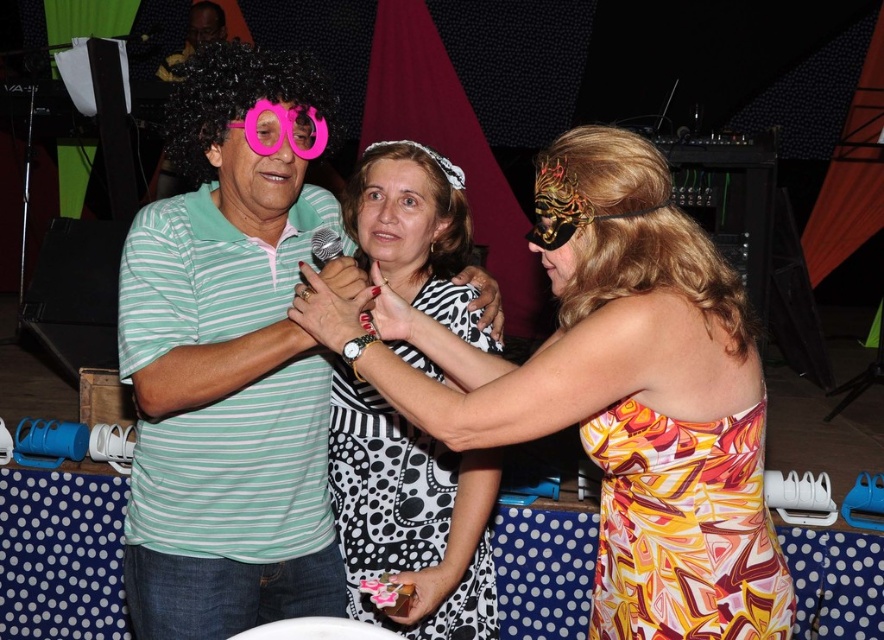
Question: Which is nearer to the black dotted fabric dress at center?

Choices:
 (A) green striped shirt at center
 (B) black curly wig at center

Answer: (A)

Question: Which of the following is the closest to the observer?

Choices:
 (A) printed fabric dress at center
 (B) black curly wig at center

Answer: (A)

Question: Is white fabric wig at center smaller than matte black wig at upper left?

Choices:
 (A) yes
 (B) no

Answer: (A)

Question: Is black curly wig at center in front of matte black wig at upper left?

Choices:
 (A) yes
 (B) no

Answer: (A)

Question: Estimate the real-world distances between objects in this image. Which object is closer to the gold metallic mask at upper right?

Choices:
 (A) black and white polka dot dress at center
 (B) green striped shirt at center
 (C) pink plastic goggles at center

Answer: (A)

Question: Is black curly wig at center wider than matte black wig at upper left?

Choices:
 (A) yes
 (B) no

Answer: (A)